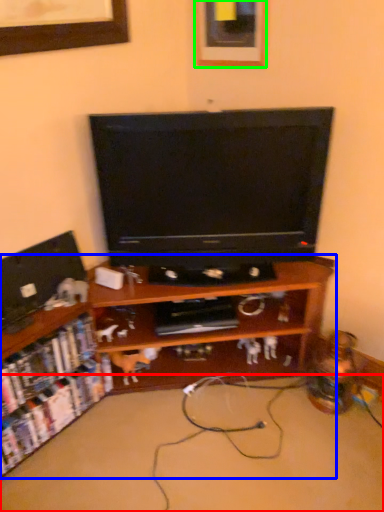
Question: Considering the real-world distances, which object is closest to plain (highlighted by a red box)? shelf (highlighted by a blue box) or picture frame (highlighted by a green box).

Choices:
 (A) shelf
 (B) picture frame

Answer: (A)